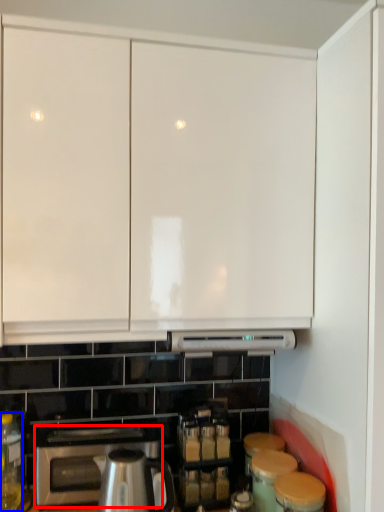
Question: Which of the following is the closest to the observer, home appliance (highlighted by a red box) or bottle (highlighted by a blue box)?

Choices:
 (A) home appliance
 (B) bottle

Answer: (B)